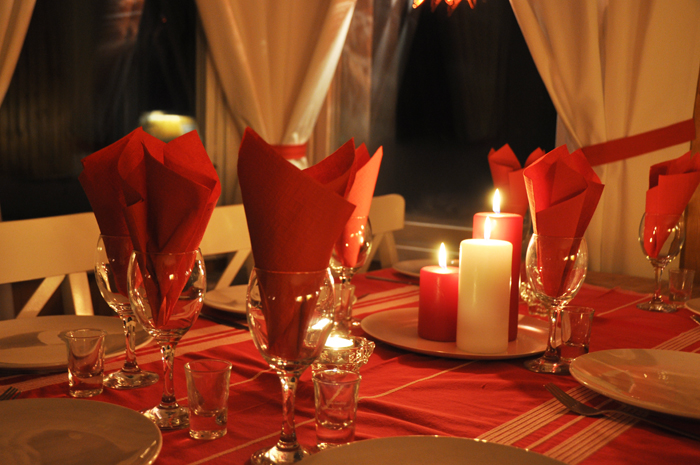
Identify the location of plates. The height and width of the screenshot is (465, 700). (232, 304), (50, 353), (120, 440), (416, 452), (612, 379), (399, 333), (414, 270), (693, 304).